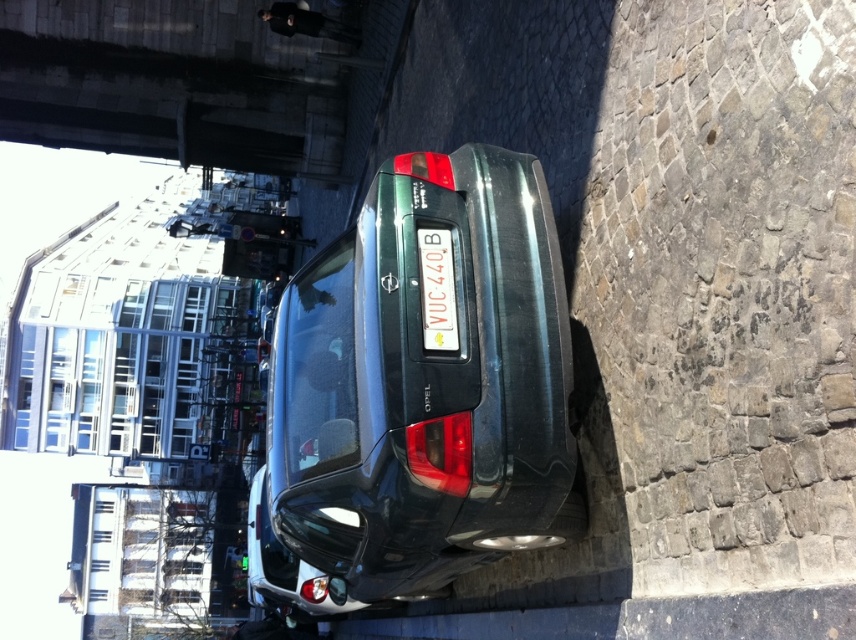
You are a delivery driver trying to navigate through the area shown in the image. You need to drive the metallic green car at center under the concrete bridge at upper left. Based on the scene description, will the car fit under the bridge?

The metallic green car at center is located below the concrete bridge at upper left, which implies that the car is positioned under the bridge already. Therefore, the car can fit under the concrete bridge at upper left.

You are a photographer planning to take a wide shot of the scene. You need to include both the metallic green car at center and the concrete bridge at upper left. Based on their sizes, which object should you focus on to ensure both fit in the frame?

The metallic green car at center is larger than the concrete bridge at upper left, so focusing on the metallic green car at center will ensure both fit in the frame.

You are a delivery person trying to park your delivery van next to the metallic green car at center and the white plastic license plate at center. Based on their sizes, which vehicle would you estimate takes up more vertical space in the parking spot?

The metallic green car at center is much taller than the white plastic license plate at center, so it would take up more vertical space in the parking spot.